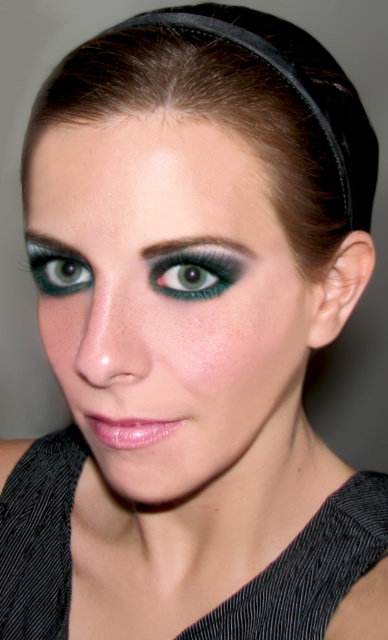
Does teal matte eye at center have a lesser width compared to shiny pink lipstick at center?

Incorrect, teal matte eye at center's width is not less than shiny pink lipstick at center's.

Which is above, teal matte eye at center or shiny pink lipstick at center?

teal matte eye at center is above.

Does point (204, 275) come farther from viewer compared to point (95, 422)?

No, it is in front of (95, 422).

Find the location of a particular element. This screenshot has width=388, height=640. teal matte eye at center is located at coordinates (195, 273).

From the picture: Does teal matte eye at center come in front of dark green matte eyebrow at upper center?

No, it is behind dark green matte eyebrow at upper center.

Between teal matte eye at center and dark green matte eyebrow at upper center, which one appears on the right side from the viewer's perspective?

Positioned to the right is dark green matte eyebrow at upper center.

Who is more distant from viewer, (221, 257) or (194, 257)?

The point (221, 257) is behind.

The image size is (388, 640). In order to click on teal matte eye at center in this screenshot , I will do `click(195, 273)`.

Who is positioned more to the left, matte black eye makeup at center or shiny pink lipstick at center?

shiny pink lipstick at center is more to the left.

Based on the photo, can you confirm if matte black eye makeup at center is thinner than shiny pink lipstick at center?

No, matte black eye makeup at center is not thinner than shiny pink lipstick at center.

Find the location of a particular element. matte black eye makeup at center is located at coordinates (174, 310).